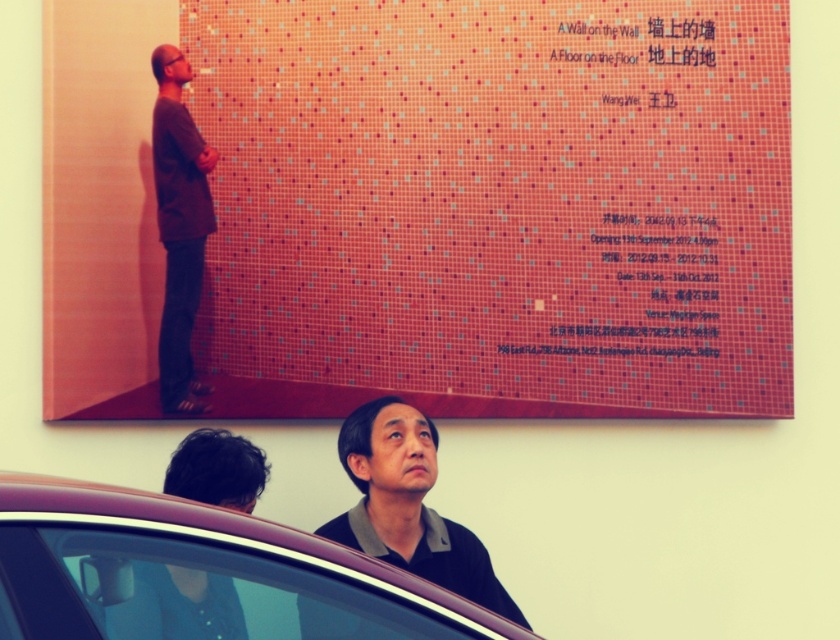
Question: Which of the following is the closest to the observer?

Choices:
 (A) (455, 19)
 (B) (405, 404)

Answer: (B)

Question: Does matte pink tile at upper center appear under brown matte sweater at upper left?

Choices:
 (A) no
 (B) yes

Answer: (A)

Question: In this image, where is black matte shirt at center located relative to brown matte sweater at upper left?

Choices:
 (A) left
 (B) right

Answer: (B)

Question: Among these objects, which one is nearest to the camera?

Choices:
 (A) brown matte sweater at upper left
 (B) dark brown hair at upper center
 (C) metallic car at lower center
 (D) black matte shirt at center

Answer: (C)

Question: Which of these objects is positioned closest to the dark brown hair at upper center?

Choices:
 (A) brown matte sweater at upper left
 (B) black matte shirt at center
 (C) metallic car at lower center

Answer: (B)

Question: Is black matte shirt at center above dark brown hair at upper center?

Choices:
 (A) yes
 (B) no

Answer: (B)